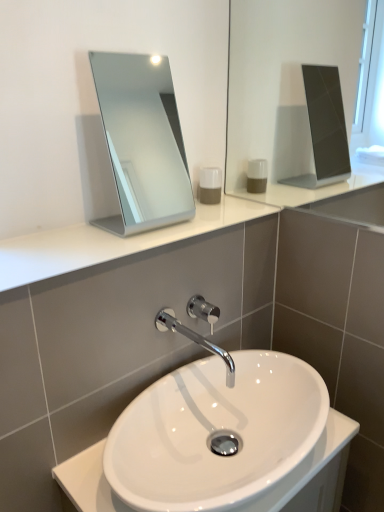
Describe the element at coordinates (314, 473) in the screenshot. I see `white glossy sink at center, the second counter top viewed from the top` at that location.

This screenshot has height=512, width=384. Describe the element at coordinates (142, 141) in the screenshot. I see `silver metallic mirror at upper center` at that location.

Where is `translucent plastic soap dispenser at center`? The height and width of the screenshot is (512, 384). translucent plastic soap dispenser at center is located at coordinates (210, 185).

The height and width of the screenshot is (512, 384). What do you see at coordinates (109, 242) in the screenshot? I see `white glossy countertop at upper center, positioned as the 2th counter top in bottom-to-top order` at bounding box center [109, 242].

The height and width of the screenshot is (512, 384). I want to click on white glossy sink at center, so click(x=215, y=428).

In the scene shown: From the image's perspective, who appears lower, white glossy countertop at upper center, positioned as the 2th counter top in bottom-to-top order, or silver metallic mirror at upper center?

white glossy countertop at upper center, positioned as the 2th counter top in bottom-to-top order, from the image's perspective.

Which object is closer to the camera taking this photo, white glossy countertop at upper center, arranged as the 1th counter top when viewed from the top, or silver metallic mirror at upper center?

white glossy countertop at upper center, arranged as the 1th counter top when viewed from the top, is more forward.

Can you confirm if white glossy countertop at upper center, positioned as the 2th counter top in bottom-to-top order, is smaller than silver metallic mirror at upper center?

Yes, white glossy countertop at upper center, positioned as the 2th counter top in bottom-to-top order, is smaller than silver metallic mirror at upper center.

Which object is positioned more to the right, white glossy countertop at upper center, positioned as the 2th counter top in bottom-to-top order, or silver metallic mirror at upper center?

silver metallic mirror at upper center.

Does white glossy sink at center, arranged as the 1th counter top when ordered from the bottom, appear on the right side of silver metallic mirror at upper center?

Indeed, white glossy sink at center, arranged as the 1th counter top when ordered from the bottom, is positioned on the right side of silver metallic mirror at upper center.

Between white glossy sink at center, arranged as the 1th counter top when ordered from the bottom, and silver metallic mirror at upper center, which one has larger size?

With larger size is white glossy sink at center, arranged as the 1th counter top when ordered from the bottom.

From the image's perspective, which one is positioned lower, white glossy sink at center, arranged as the 1th counter top when ordered from the bottom, or silver metallic mirror at upper center?

white glossy sink at center, arranged as the 1th counter top when ordered from the bottom, is shown below in the image.

From a real-world perspective, is white glossy sink at center, the second counter top viewed from the top, positioned under silver metallic mirror at upper center based on gravity?

Yes, from a real-world perspective, white glossy sink at center, the second counter top viewed from the top, is below silver metallic mirror at upper center.

Considering the positions of objects chrome/metallic faucet at center and white glossy countertop at upper center, arranged as the 1th counter top when viewed from the top, in the image provided, who is more to the left, chrome/metallic faucet at center or white glossy countertop at upper center, arranged as the 1th counter top when viewed from the top,?

From the viewer's perspective, white glossy countertop at upper center, arranged as the 1th counter top when viewed from the top, appears more on the left side.

Is chrome/metallic faucet at center beside white glossy countertop at upper center, arranged as the 1th counter top when viewed from the top?

chrome/metallic faucet at center and white glossy countertop at upper center, arranged as the 1th counter top when viewed from the top, are not in contact.

Between chrome/metallic faucet at center and white glossy countertop at upper center, arranged as the 1th counter top when viewed from the top, which one is positioned in front?

white glossy countertop at upper center, arranged as the 1th counter top when viewed from the top, is closer to the camera.

Between white glossy countertop at upper center, positioned as the 2th counter top in bottom-to-top order, and polished chrome faucet at center, which one has smaller width?

polished chrome faucet at center is thinner.

Does white glossy countertop at upper center, positioned as the 2th counter top in bottom-to-top order, lie behind polished chrome faucet at center?

No, white glossy countertop at upper center, positioned as the 2th counter top in bottom-to-top order, is closer to the camera.

Could you measure the distance between white glossy countertop at upper center, positioned as the 2th counter top in bottom-to-top order, and polished chrome faucet at center?

They are 11.66 inches apart.

Could you tell me if white glossy countertop at upper center, arranged as the 1th counter top when viewed from the top, is facing polished chrome faucet at center?

No, white glossy countertop at upper center, arranged as the 1th counter top when viewed from the top, is not oriented towards polished chrome faucet at center.

From a real-world perspective, is white glossy countertop at upper center, arranged as the 1th counter top when viewed from the top, over translucent plastic soap dispenser at center?

No, from a real-world perspective, white glossy countertop at upper center, arranged as the 1th counter top when viewed from the top, is not over translucent plastic soap dispenser at center

Are white glossy countertop at upper center, arranged as the 1th counter top when viewed from the top, and translucent plastic soap dispenser at center located far from each other?

No, white glossy countertop at upper center, arranged as the 1th counter top when viewed from the top, is in close proximity to translucent plastic soap dispenser at center.

Who is shorter, white glossy countertop at upper center, positioned as the 2th counter top in bottom-to-top order, or translucent plastic soap dispenser at center?

white glossy countertop at upper center, positioned as the 2th counter top in bottom-to-top order.

Which is more to the right, white glossy countertop at upper center, positioned as the 2th counter top in bottom-to-top order, or translucent plastic soap dispenser at center?

Positioned to the right is translucent plastic soap dispenser at center.

Is silver metallic mirror at upper center not close to chrome/metallic faucet at center?

Absolutely, silver metallic mirror at upper center is distant from chrome/metallic faucet at center.

Based on the photo, which object is positioned more to the left, silver metallic mirror at upper center or chrome/metallic faucet at center?

silver metallic mirror at upper center.

Is chrome/metallic faucet at center surrounded by silver metallic mirror at upper center?

→ That's incorrect, chrome/metallic faucet at center is not inside silver metallic mirror at upper center.

From the image's perspective, between silver metallic mirror at upper center and polished chrome faucet at center, who is located below?

polished chrome faucet at center is shown below in the image.

Who is shorter, silver metallic mirror at upper center or polished chrome faucet at center?

polished chrome faucet at center.

From a real-world perspective, does silver metallic mirror at upper center sit lower than polished chrome faucet at center?

No, from a real-world perspective, silver metallic mirror at upper center is not beneath polished chrome faucet at center.

Are silver metallic mirror at upper center and polished chrome faucet at center making contact?

No, silver metallic mirror at upper center is not in contact with polished chrome faucet at center.

Identify the location of the 1st counter top in front of the silver metallic mirror at upper center. The image size is (384, 512). (109, 242).

Locate an element on the screen. counter top on the right of silver metallic mirror at upper center is located at coordinates (314, 473).

When comparing their distances from translucent plastic soap dispenser at center, does white glossy sink at center, arranged as the 1th counter top when ordered from the bottom, or chrome/metallic faucet at center seem closer?

Based on the image, chrome/metallic faucet at center appears to be nearer to translucent plastic soap dispenser at center.

Estimate the real-world distances between objects in this image. Which object is further from white glossy sink at center, arranged as the 1th counter top when ordered from the bottom, white glossy sink at center or translucent plastic soap dispenser at center?

translucent plastic soap dispenser at center is further to white glossy sink at center, arranged as the 1th counter top when ordered from the bottom.

Considering their positions, is white glossy sink at center, the second counter top viewed from the top, positioned further to polished chrome faucet at center than chrome/metallic faucet at center?

white glossy sink at center, the second counter top viewed from the top, lies further to polished chrome faucet at center than the other object.

From the image, which object appears to be nearer to white glossy sink at center, arranged as the 1th counter top when ordered from the bottom, polished chrome faucet at center or chrome/metallic faucet at center?

chrome/metallic faucet at center.

When comparing their distances from silver metallic mirror at upper center, does chrome/metallic faucet at center or white glossy sink at center seem closer?

Based on the image, white glossy sink at center appears to be nearer to silver metallic mirror at upper center.

When comparing their distances from white glossy countertop at upper center, positioned as the 2th counter top in bottom-to-top order, does white glossy sink at center or white glossy sink at center, the second counter top viewed from the top, seem further?

Based on the image, white glossy sink at center, the second counter top viewed from the top, appears to be further to white glossy countertop at upper center, positioned as the 2th counter top in bottom-to-top order.

Estimate the real-world distances between objects in this image. Which object is closer to translucent plastic soap dispenser at center, white glossy countertop at upper center, arranged as the 1th counter top when viewed from the top, or silver metallic mirror at upper center?

Among the two, white glossy countertop at upper center, arranged as the 1th counter top when viewed from the top, is located nearer to translucent plastic soap dispenser at center.

Considering their positions, is white glossy sink at center, the second counter top viewed from the top, positioned closer to white glossy sink at center than chrome/metallic faucet at center?

Among the two, chrome/metallic faucet at center is located nearer to white glossy sink at center.

I want to click on counter top between silver metallic mirror at upper center and polished chrome faucet at center in the vertical direction, so click(x=109, y=242).

The width and height of the screenshot is (384, 512). I want to click on knob between translucent plastic soap dispenser at center and chrome/metallic faucet at center from top to bottom, so click(202, 309).

Where is `sink between white glossy countertop at upper center, arranged as the 1th counter top when viewed from the top, and white glossy sink at center, the second counter top viewed from the top, from top to bottom`? Image resolution: width=384 pixels, height=512 pixels. sink between white glossy countertop at upper center, arranged as the 1th counter top when viewed from the top, and white glossy sink at center, the second counter top viewed from the top, from top to bottom is located at coordinates (215, 428).

Find the location of a particular element. sink that lies between silver metallic mirror at upper center and white glossy sink at center, the second counter top viewed from the top, from top to bottom is located at coordinates (215, 428).